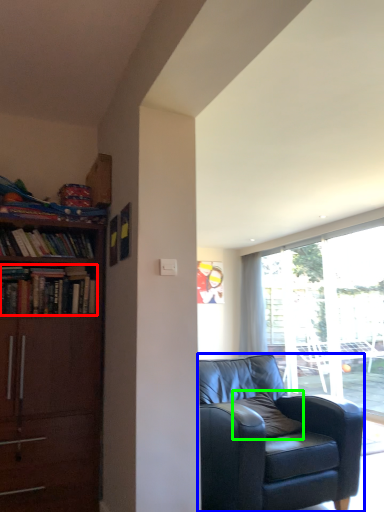
Question: Which is farther away from book (highlighted by a red box)? chair (highlighted by a blue box) or pillow (highlighted by a green box)?

Choices:
 (A) chair
 (B) pillow

Answer: (B)